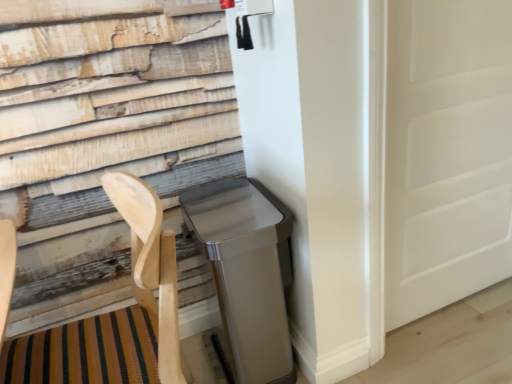
Question: Is white matte door at right at the left side of natural wood folding chair at lower left?

Choices:
 (A) yes
 (B) no

Answer: (B)

Question: Is white matte door at right positioned behind natural wood folding chair at lower left?

Choices:
 (A) yes
 (B) no

Answer: (A)

Question: Is white matte door at right surrounding natural wood folding chair at lower left?

Choices:
 (A) no
 (B) yes

Answer: (A)

Question: Is white matte door at right thinner than natural wood folding chair at lower left?

Choices:
 (A) yes
 (B) no

Answer: (A)

Question: Considering the relative sizes of white matte door at right and natural wood folding chair at lower left in the image provided, is white matte door at right smaller than natural wood folding chair at lower left?

Choices:
 (A) no
 (B) yes

Answer: (B)

Question: Considering the relative sizes of white matte door at right and natural wood folding chair at lower left in the image provided, is white matte door at right taller than natural wood folding chair at lower left?

Choices:
 (A) yes
 (B) no

Answer: (A)

Question: Is white matte door at right positioned behind satin silver trash can at lower right?

Choices:
 (A) yes
 (B) no

Answer: (A)

Question: Can you confirm if white matte door at right is positioned to the left of satin silver trash can at lower right?

Choices:
 (A) no
 (B) yes

Answer: (A)

Question: From the image's perspective, is white matte door at right under satin silver trash can at lower right?

Choices:
 (A) yes
 (B) no

Answer: (B)

Question: Is satin silver trash can at lower right at the back of white matte door at right?

Choices:
 (A) no
 (B) yes

Answer: (A)

Question: From a real-world perspective, is white matte door at right located higher than satin silver trash can at lower right?

Choices:
 (A) yes
 (B) no

Answer: (A)

Question: Can you see white matte door at right touching satin silver trash can at lower right?

Choices:
 (A) no
 (B) yes

Answer: (A)

Question: Is natural wood folding chair at lower left aimed at white matte door at right?

Choices:
 (A) no
 (B) yes

Answer: (A)